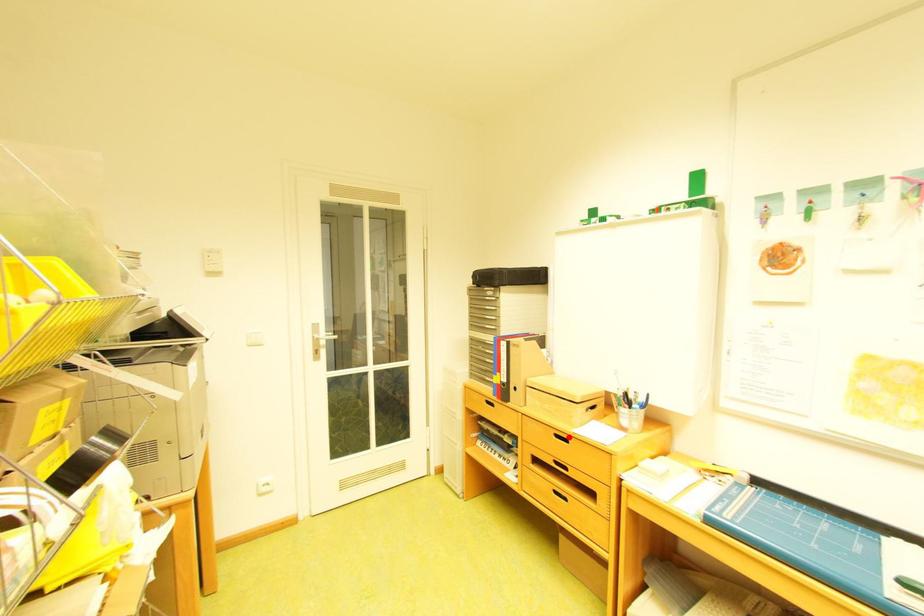
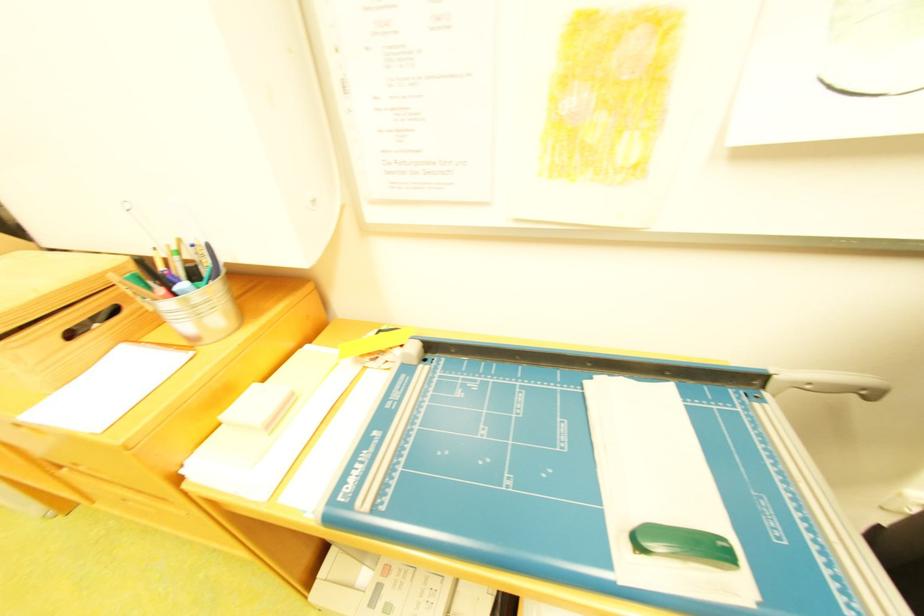
Question: I am providing you with two images of the same scene from different viewpoints. A red point is marked on the first image. At the location where the point appears in image 1, is it still visible in image 2?

Choices:
 (A) Yes
 (B) No

Answer: (B)